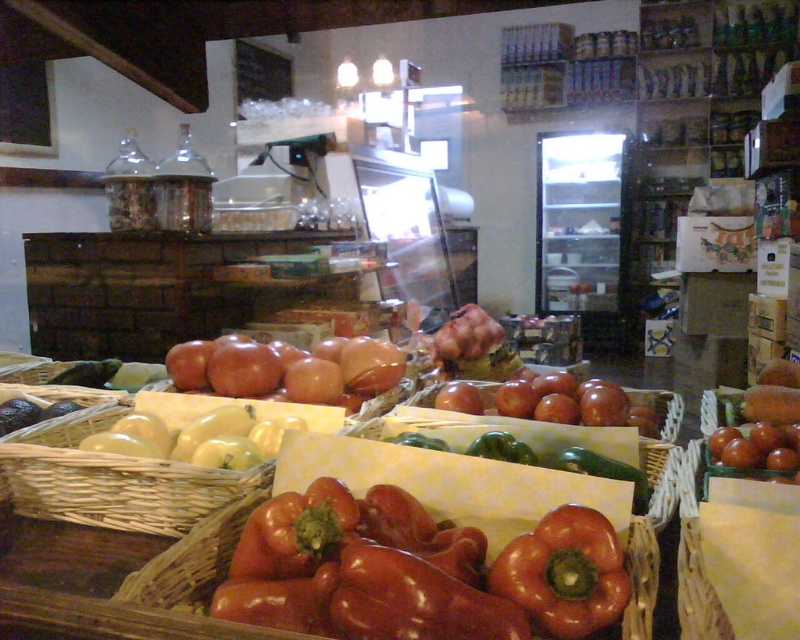
Question: Can you confirm if shiny red bell pepper at lower center is smaller than matte brown apples at center?

Choices:
 (A) yes
 (B) no

Answer: (A)

Question: Does shiny red bell pepper at lower center have a greater width compared to matte brown apples at center?

Choices:
 (A) no
 (B) yes

Answer: (A)

Question: Among these objects, which one is nearest to the camera?

Choices:
 (A) shiny brown basket at center
 (B) green matte apples at lower left
 (C) shiny red bell pepper at lower center
 (D) matte brown apples at center

Answer: (A)

Question: Is shiny red bell pepper at lower center bigger than green matte apples at lower left?

Choices:
 (A) yes
 (B) no

Answer: (B)

Question: Which is nearer to the shiny red bell pepper at lower center?

Choices:
 (A) matte brown apples at center
 (B) green matte apples at lower left

Answer: (B)

Question: Which point is closer to the camera taking this photo?

Choices:
 (A) (540, 589)
 (B) (178, 445)

Answer: (A)